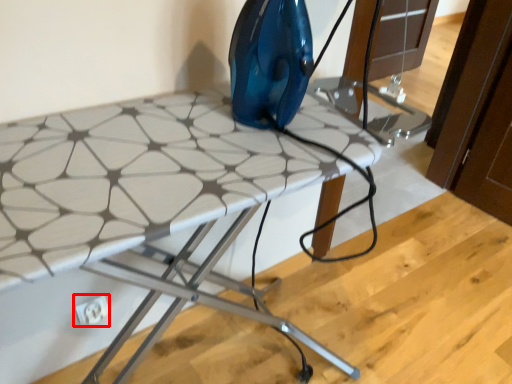
Question: From the image, what is the correct spatial relationship of electric outlet (annotated by the red box) in relation to table?

Choices:
 (A) left
 (B) right

Answer: (A)